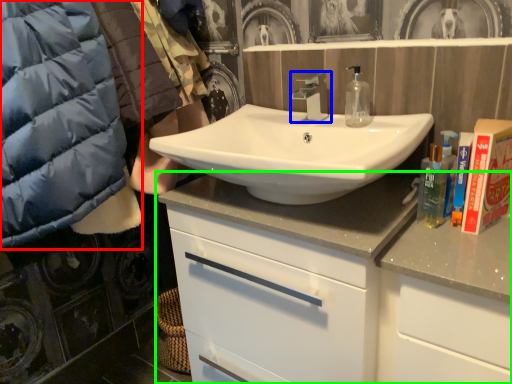
Question: Considering the real-world distances, which object is closest to jacket (highlighted by a red box)? tap (highlighted by a blue box) or bathroom cabinet (highlighted by a green box).

Choices:
 (A) tap
 (B) bathroom cabinet

Answer: (B)